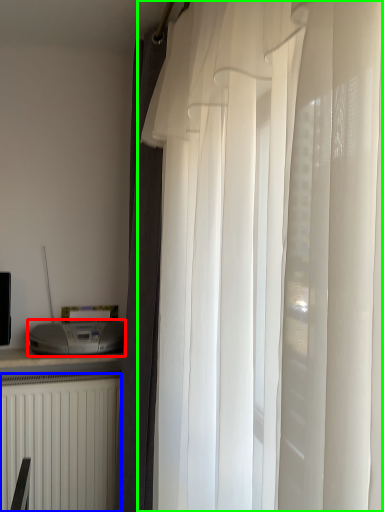
Question: Which is farther away from appliance (highlighted by a red box)? radiator (highlighted by a blue box) or curtain (highlighted by a green box)?

Choices:
 (A) radiator
 (B) curtain

Answer: (B)